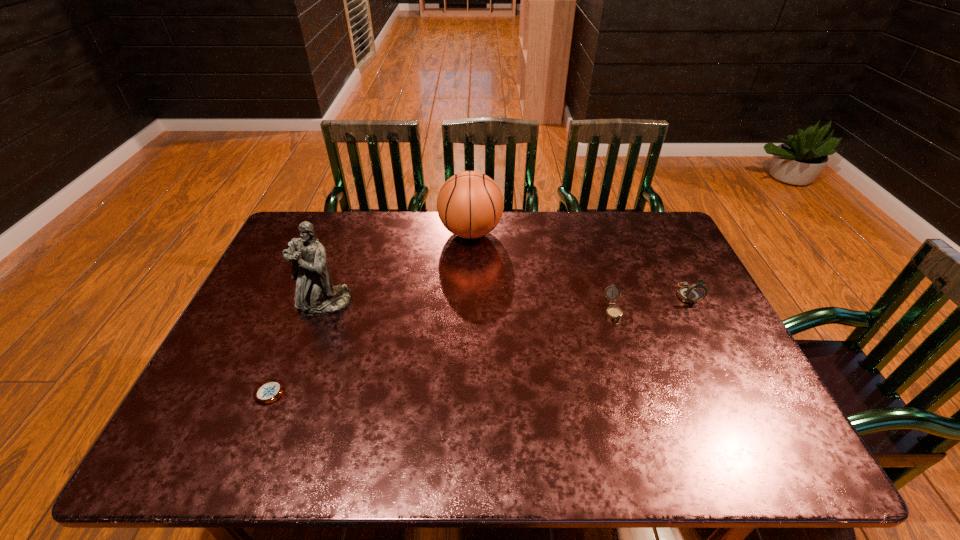
Where is `vacant area between the fourth object from left to right and the farthest object`? The width and height of the screenshot is (960, 540). vacant area between the fourth object from left to right and the farthest object is located at coordinates (542, 272).

At what (x,y) coordinates should I click in order to perform the action: click on vacant space that's between the tallest object and the rightmost compass. Please return your answer as a coordinate pair (x, y). Image resolution: width=960 pixels, height=540 pixels. Looking at the image, I should click on (506, 299).

I want to click on vacant point located between the second object from right to left and the shortest object, so click(441, 353).

The width and height of the screenshot is (960, 540). Identify the location of object that is the second closest to the basketball. (615, 313).

The image size is (960, 540). What are the coordinates of `object that can be found as the third closest to the second tallest object` in the screenshot? It's located at (691, 294).

Where is `the closest compass to the third object from left to right`? The image size is (960, 540). the closest compass to the third object from left to right is located at coordinates (615, 313).

Where is `compass object that ranks as the second closest to the tallest compass`? The height and width of the screenshot is (540, 960). compass object that ranks as the second closest to the tallest compass is located at coordinates (268, 391).

Locate an element on the screen. Image resolution: width=960 pixels, height=540 pixels. vacant point that satisfies the following two spatial constraints: 1. on the back side of the third object from right to left; 2. on the right side of the shortest object is located at coordinates (334, 232).